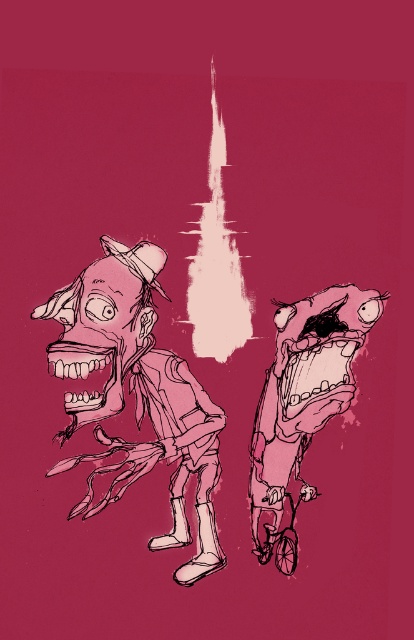
Is pink matte zombie at left smaller than pink matte/soft sculpture at center?

No.

Which is more to the left, pink matte zombie at left or pink matte/soft sculpture at center?

Positioned to the left is pink matte zombie at left.

Identify the location of pink matte zombie at left. (137, 392).